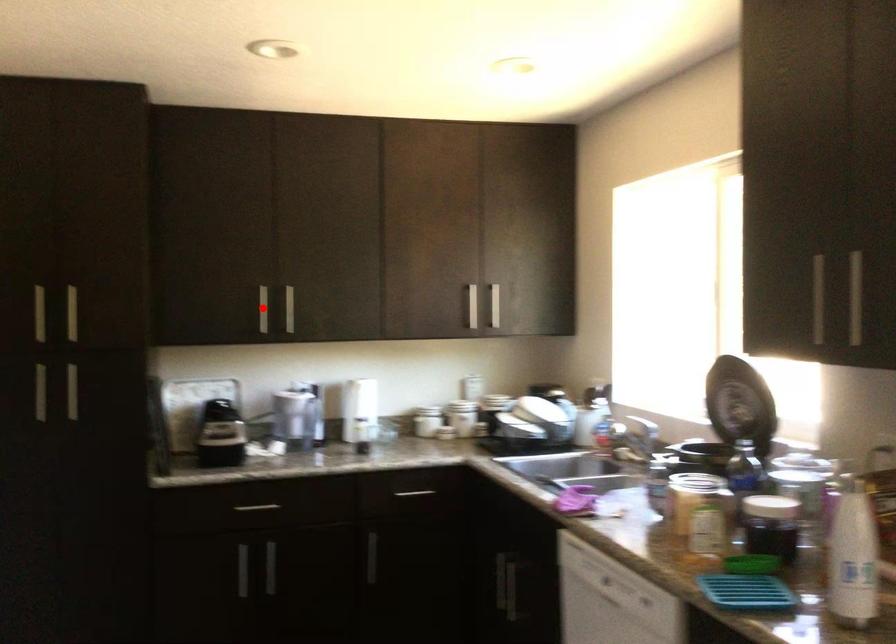
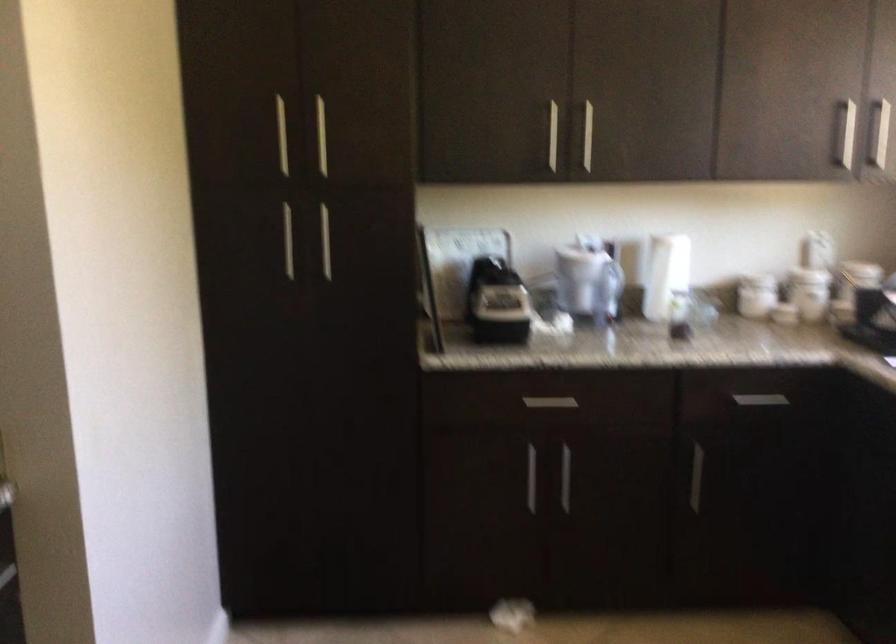
Locate, in the second image, the point that corresponds to the highlighted location in the first image.

(552, 136)